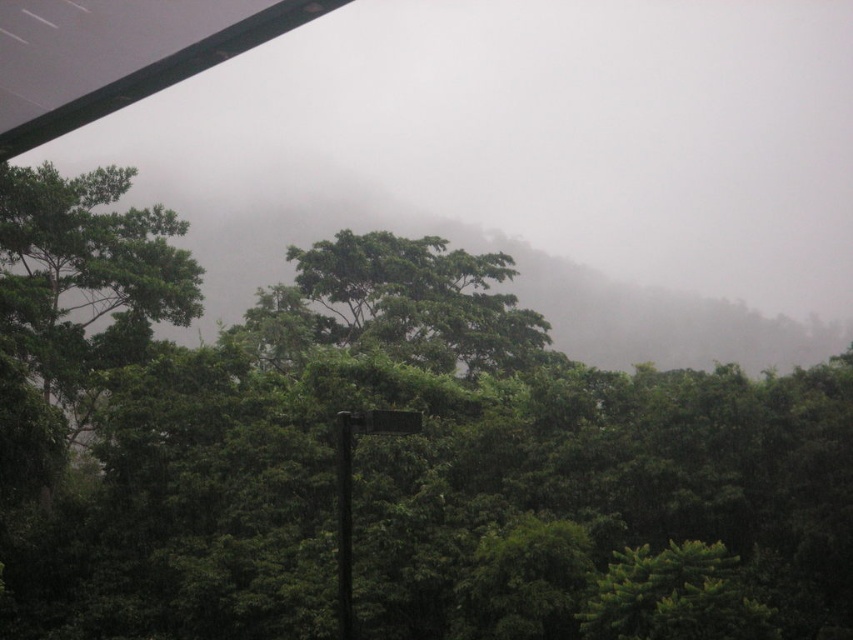
You are hiking in a misty forest and come across a wooden sign at center and a green matte pole at center. According to the scene, which object is positioned to the right side?

The wooden sign at center is positioned to the right of the green matte pole at center.

You are a hiker trying to navigate through the forest. You see a green leafy tree at center and a green matte pole at center. Which object is higher up in the scene?

The green leafy tree at center is located above the green matte pole at center, so it is higher up in the scene.

You are a hiker who wants to reach a specific point in the forest. You are currently standing at the viewpoint where the image was taken. The point you want to reach is labeled as point [389,266]. Considering the dense fog in the background, do you think you can see this point clearly from your current position?

The distance of point [389,266] from viewer is 47.75 meters. Since the background is enveloped in a thick layer of fog, which diffuses the light and creates a soft, ethereal atmosphere, you may not be able to see the point clearly from your current position due to reduced visibility caused by the fog.